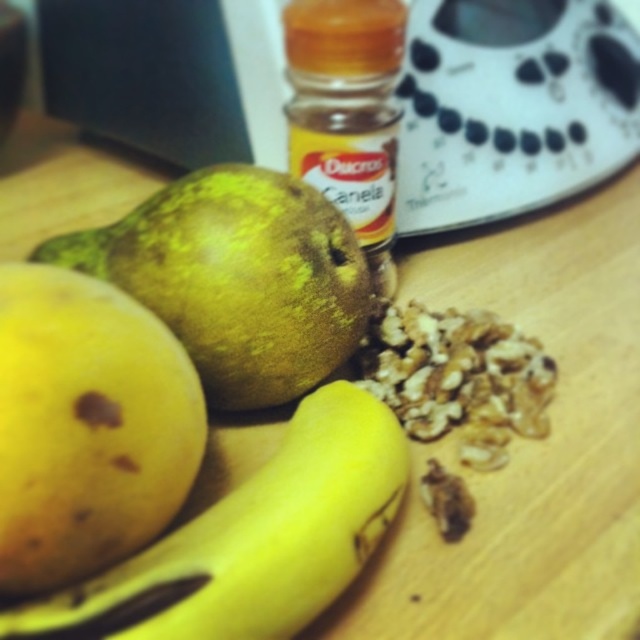
You are organizing a fruit basket and need to know which fruit is smaller between the yellow matte apple at lower left and the green matte pear at center. Which one should you choose?

The yellow matte apple at lower left has a smaller size compared to the green matte pear at center, so you should choose the yellow matte apple at lower left for the fruit basket.

You are arranging fruits on a wooden kitchen counter. You have a yellow matte apple at lower left and a green matte pear at center. According to the scene, which fruit is placed underneath the other?

The yellow matte apple at lower left is positioned under the green matte pear at center, so the apple is underneath the pear.